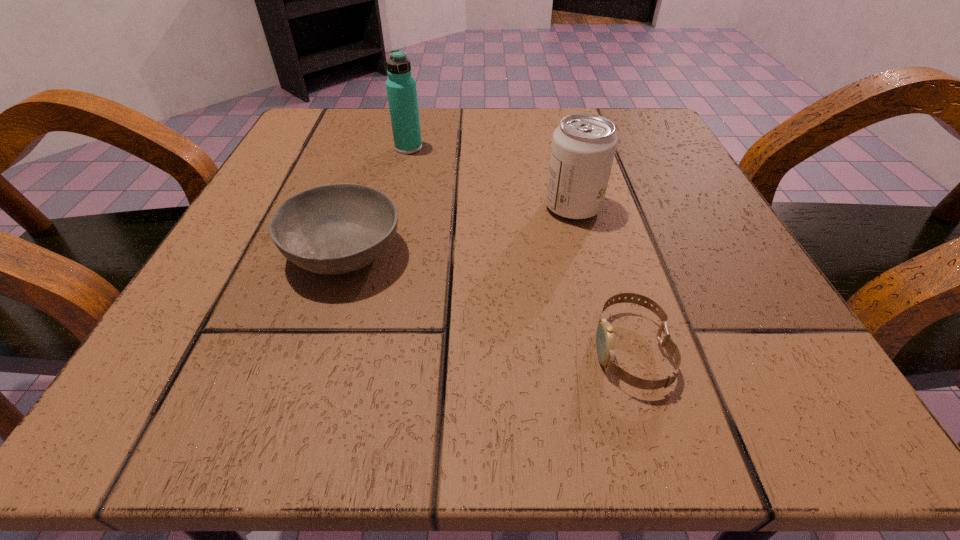
Image resolution: width=960 pixels, height=540 pixels. Find the location of `free point between the bowl and the shortest object`. free point between the bowl and the shortest object is located at coordinates 488,302.

Identify which object is the third nearest to the nearest object. Please provide its 2D coordinates. Your answer should be formatted as a tuple, i.e. [(x, y)], where the tuple contains the x and y coordinates of a point satisfying the conditions above.

[(401, 89)]

Select which object appears as the closest to the thermos bottle. Please provide its 2D coordinates. Your answer should be formatted as a tuple, i.e. [(x, y)], where the tuple contains the x and y coordinates of a point satisfying the conditions above.

[(331, 229)]

This screenshot has height=540, width=960. In order to click on vacant space that satisfies the following two spatial constraints: 1. on the back side of the soda can; 2. on the left side of the bowl in this screenshot , I will do `click(359, 207)`.

Identify the location of free region that satisfies the following two spatial constraints: 1. on the back side of the bowl; 2. on the left side of the thermos bottle. (379, 148).